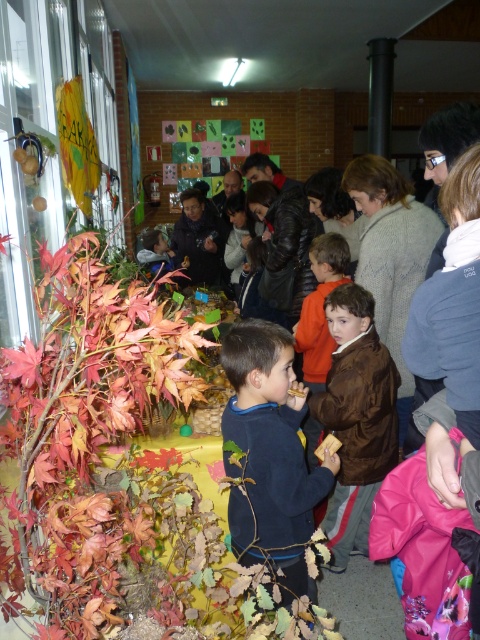
You are standing in the middle of the room and want to walk towards the two points marked in the image. Which point, point (302,584) or point (332,508), will you reach first?

Point (302,584) is in front of point (332,508), so you will reach point (302,584) first.

You are organizing a fall festival booth and need to arrange items on a table. You have the autumn leaves at left and the dark blue sweater at center. Which item should you place first if you want to ensure there is enough space for both?

You should place the autumn leaves at left first since they are larger in size compared to the dark blue sweater at center, ensuring there is enough space for both items.